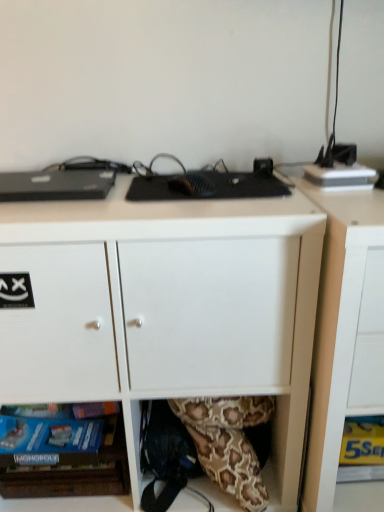
Where is `free space above white matte desk at center (from a real-world perspective)`? This screenshot has width=384, height=512. free space above white matte desk at center (from a real-world perspective) is located at coordinates (151, 197).